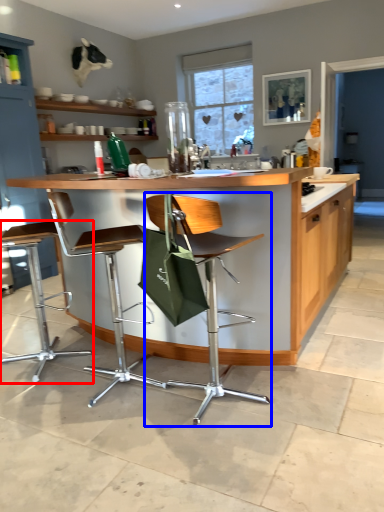
Question: Which object appears closest to the camera in this image, chair (highlighted by a red box) or chair (highlighted by a blue box)?

Choices:
 (A) chair
 (B) chair

Answer: (B)